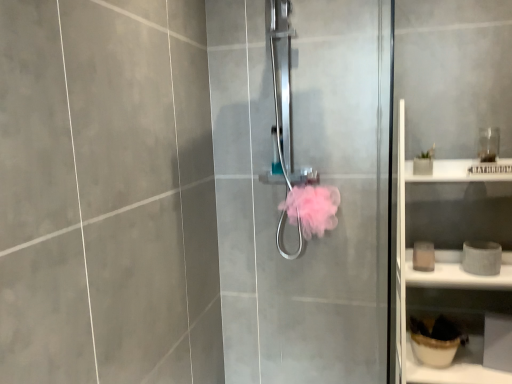
Question: Should I look upward or downward to see white matte cabinet at right?

Choices:
 (A) up
 (B) down

Answer: (B)